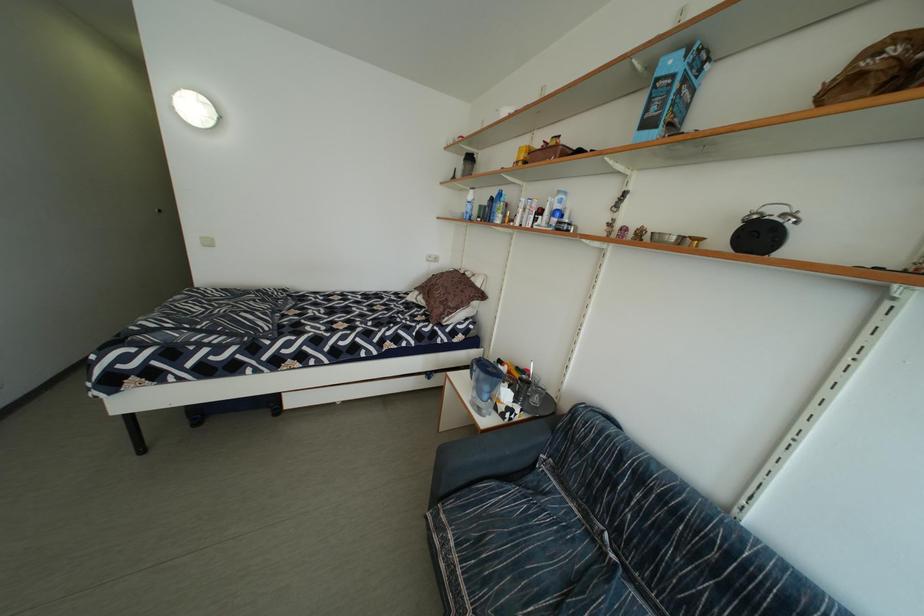
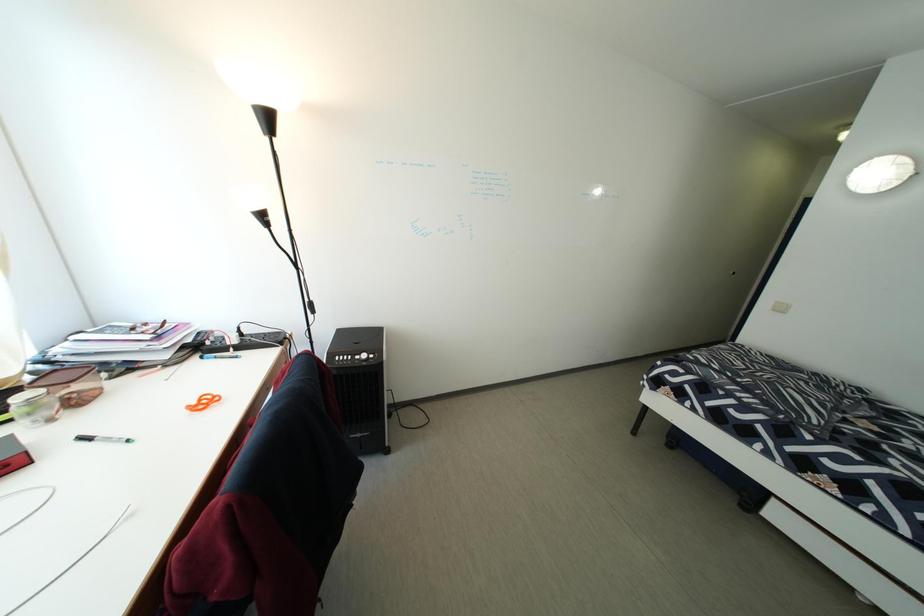
Question: The images are taken continuously from a first-person perspective. In which direction is your viewpoint rotating?

Choices:
 (A) Left
 (B) Right
 (C) Up
 (D) Down

Answer: (A)